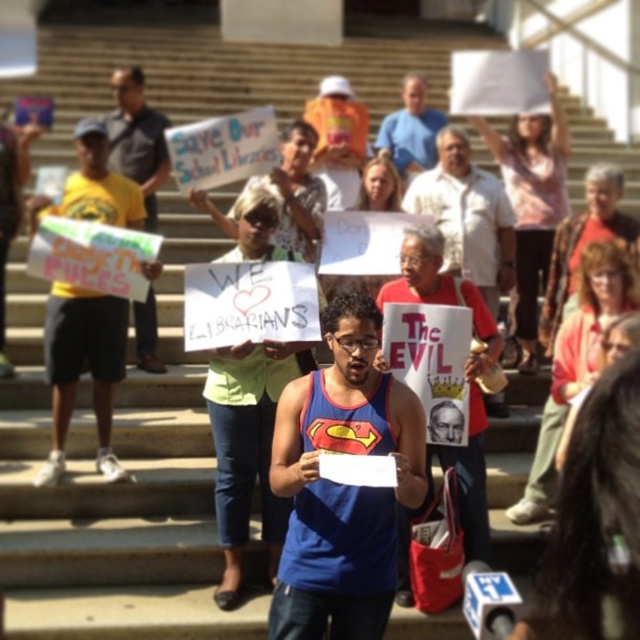
Looking at this image, you are a photographer trying to capture a photo of the protest scene. You want to ensure both the blue fabric tank top at center and the yellow cotton shirt at left are clearly visible. Based on their heights, which one should you focus on first to ensure it appears in the foreground?

The blue fabric tank top at center is taller than the yellow cotton shirt at left, so focusing on the blue fabric tank top at center first would ensure it appears in the foreground since taller objects are typically closer and more prominent in photos.

You are standing at the point labeled point (289, 420) and want to take a photo of the protest scene. The camera you have can focus on objects within 7 meters. Will the camera be able to capture the entire protest scene clearly?

The distance between point (289, 420) and the camera is 6.88 meters, which is within the camera focus range of 7 meters. Therefore, the camera can capture the entire protest scene clearly.